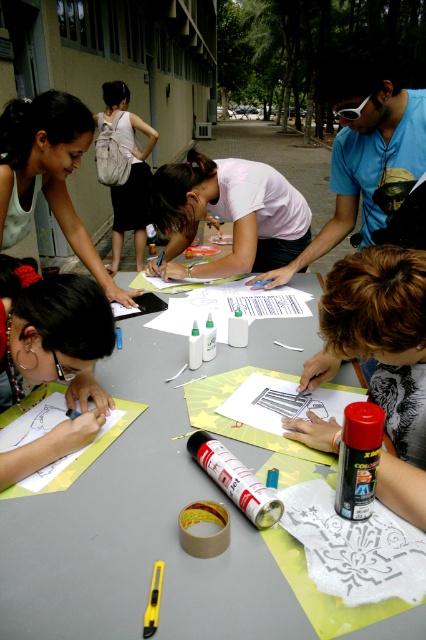
You are an artist attending this event and need to place your canvas on the gray matte table at center. However, your canvas is 1.2 meters wide. Can you fit it on the table without overlapping the white matte shirt at center?

The gray matte table at center is to the left of the white matte shirt at center, but the exact dimensions of the table are not provided. Therefore, it is uncertain if the 1.2 meter wide canvas will fit without overlapping.

You are an artist at the event and need to locate your spray can quickly. You remember that the matte white spray can at center is positioned relative to your matte black hair at center. Which direction should you look to find it?

The matte white spray can at center is to the right of matte black hair at center, so you should look to your right to find it.